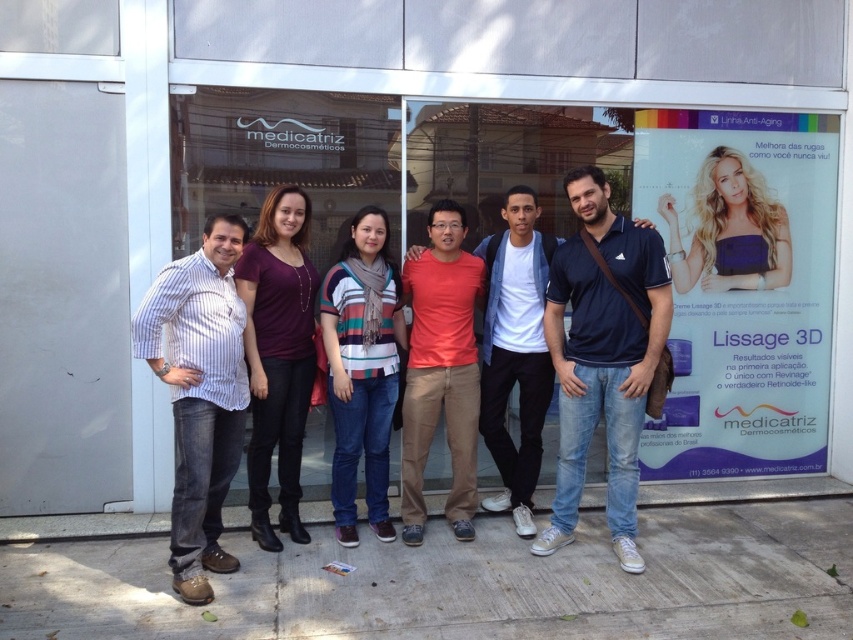
Question: Does matte purple shirt at center appear on the left side of striped sweater at center?

Choices:
 (A) no
 (B) yes

Answer: (B)

Question: Which point is farther to the camera?

Choices:
 (A) red matte shirt at center
 (B) blonde hair at center
 (C) blue cotton polo shirt at center

Answer: (B)

Question: Does striped cotton shirt at left have a greater width compared to red matte shirt at center?

Choices:
 (A) yes
 (B) no

Answer: (B)

Question: Which point is closer to the camera?

Choices:
 (A) striped sweater at center
 (B) blonde hair at center
 (C) red matte shirt at center
 (D) blue cotton polo shirt at center

Answer: (D)

Question: Does striped cotton shirt at left have a larger size compared to matte purple shirt at center?

Choices:
 (A) yes
 (B) no

Answer: (A)

Question: Among these objects, which one is nearest to the camera?

Choices:
 (A) striped sweater at center
 (B) blonde hair at center

Answer: (A)